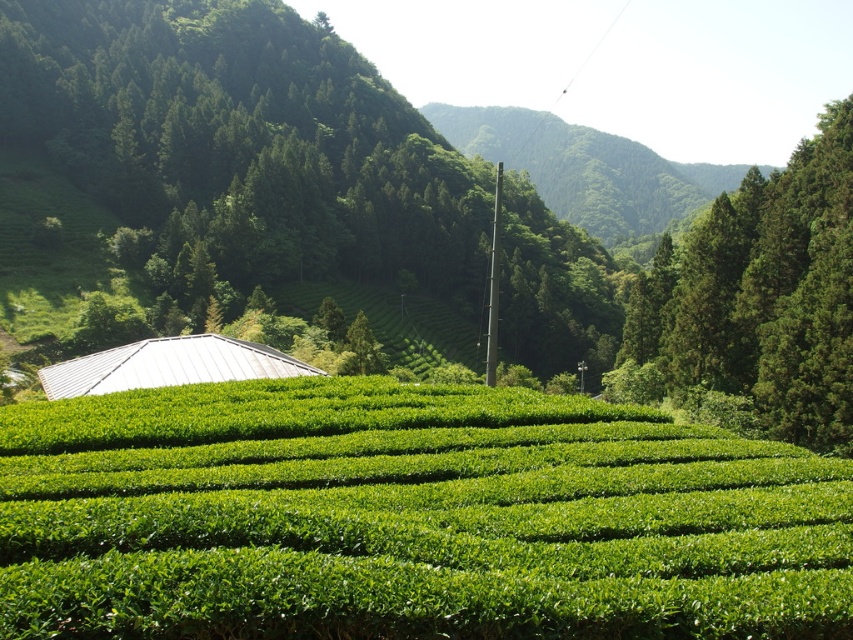
You are standing at the point with coordinates point (1,605) and want to walk towards the point with coordinates point (810,298). According to the image, will you have to go through any obstacles like the tea plantation or the forested hillside?

Point (1,605) is in front of point (810,298), so you will have to go through the tea plantation and the forested hillside to reach the destination.